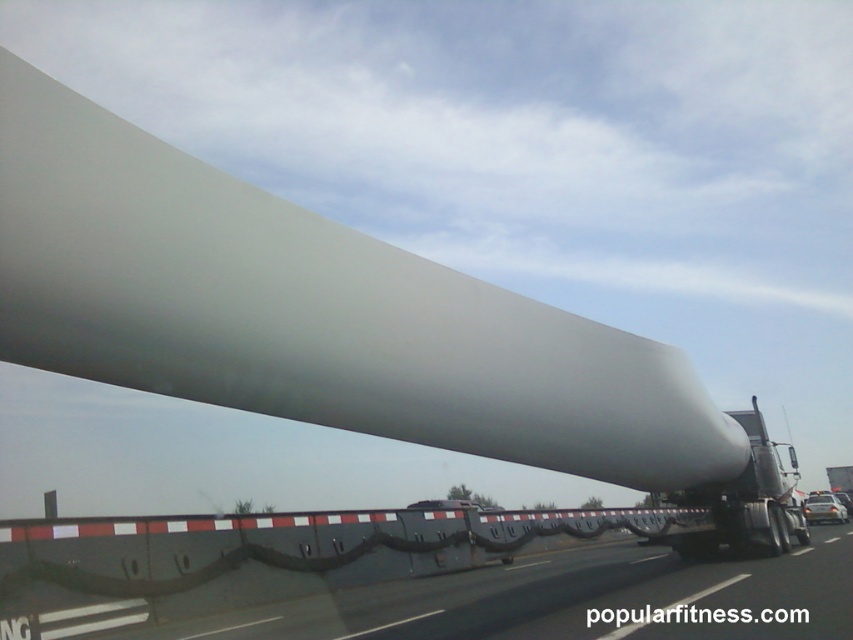
You are a traffic officer assessing the transport of the white matte wind turbine blade at right on the flatbed truck. You notice the black rubber barrier at center along the road. Based on their heights, do you think the blade will clear the barrier without any adjustments?

The white matte wind turbine blade at right is taller than the black rubber barrier at center, so it will clear the barrier without any adjustments.

You are standing at the camera position and want to pick up an object located at point (x=149, y=522). Can you reach it without moving your feet?

The point (x=149, y=522) is 3.99 meters away from the camera, so you cannot reach it without moving your feet since it is too far.

From the picture: You are a truck driver transporting the white matte wind turbine blade at right. There is a black rubber barrier at center on the side of the road. According to safety regulations, the minimum safe distance between the turbine blade and any obstacles is 5 meters. Do you think your current distance is sufficient?

The black rubber barrier at center is 4.67 meters away from the white matte wind turbine blade at right. Since the required minimum safe distance is 5 meters, the current distance is insufficient. You need to increase the distance to meet safety standards.